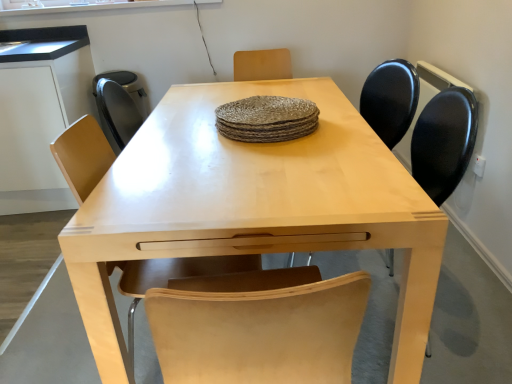
You are a GUI agent. You are given a task and a screenshot of the screen. Output one action in this format:
    pyautogui.click(x=<x>, y=<y>)
    Task: Click on the rustic woven placemat at center
    Image resolution: width=512 pixels, height=384 pixels.
    Given the screenshot: What is the action you would take?
    pyautogui.click(x=267, y=119)

Where is `matte black computer desk at left`? matte black computer desk at left is located at coordinates pyautogui.click(x=40, y=112).

Locate an element on the screen. The image size is (512, 384). light wood table at center is located at coordinates (254, 205).

Is the depth of matte black computer desk at left greater than that of light brown wood chair at center, the 2th chair in the right-to-left sequence?

Yes, it is.

From the picture: Who is shorter, matte black computer desk at left or light brown wood chair at center, the 2th chair in the right-to-left sequence?

light brown wood chair at center, the 2th chair in the right-to-left sequence.

Is matte black computer desk at left bigger or smaller than light brown wood chair at center, the 2th chair in the right-to-left sequence?

A: Considering their sizes, matte black computer desk at left takes up more space than light brown wood chair at center, the 2th chair in the right-to-left sequence.

Identify the location of computer desk on the left of light brown wood chair at center, the first chair from the left. click(40, 112).

Would you say light wood table at center is a long distance from matte black computer desk at left?

Yes, light wood table at center and matte black computer desk at left are located far from each other.

From the image's perspective, between light wood table at center and matte black computer desk at left, which one is located above?

matte black computer desk at left.

Between light wood table at center and matte black computer desk at left, which one appears on the right side from the viewer's perspective?

light wood table at center.

Is light brown wood chair at center, the first chair from the left, positioned before rustic woven placemat at center?

Yes, light brown wood chair at center, the first chair from the left, is in front of rustic woven placemat at center.

Is light brown wood chair at center, the 2th chair in the right-to-left sequence, at the right side of rustic woven placemat at center?

No, light brown wood chair at center, the 2th chair in the right-to-left sequence, is not to the right of rustic woven placemat at center.

Can you see light brown wood chair at center, the first chair from the left, touching rustic woven placemat at center?

light brown wood chair at center, the first chair from the left, and rustic woven placemat at center are not in contact.

Is matte black computer desk at left aimed at rustic woven placemat at center?

No, matte black computer desk at left does not turn towards rustic woven placemat at center.

How much distance is there between matte black computer desk at left and rustic woven placemat at center?

matte black computer desk at left and rustic woven placemat at center are 1.35 meters apart from each other.

Based on the photo, is matte black computer desk at left far from rustic woven placemat at center?

Yes.

Considering the positions of objects matte black computer desk at left and rustic woven placemat at center in the image provided, who is more to the right, matte black computer desk at left or rustic woven placemat at center?

rustic woven placemat at center is more to the right.

Consider the image. Which object is more forward, rustic woven placemat at center or light brown wood chair at center, the first chair from the left?

light brown wood chair at center, the first chair from the left, is closer to the camera.

Could light brown wood chair at center, the 2th chair in the right-to-left sequence, be considered to be inside rustic woven placemat at center?

Definitely not — light brown wood chair at center, the 2th chair in the right-to-left sequence, is not inside rustic woven placemat at center.

Considering the sizes of objects rustic woven placemat at center and light brown wood chair at center, the first chair from the left, in the image provided, who is bigger, rustic woven placemat at center or light brown wood chair at center, the first chair from the left,?

With larger size is light brown wood chair at center, the first chair from the left.

Locate an element on the screen. This screenshot has width=512, height=384. chair to the left of rustic woven placemat at center is located at coordinates (170, 277).

Which object is wider, light brown wood chair at center, the first chair from the left, or matte black computer desk at left?

With larger width is matte black computer desk at left.

Between light brown wood chair at center, the first chair from the left, and matte black computer desk at left, which one has less height?

light brown wood chair at center, the first chair from the left.

Measure the distance between light brown wood chair at center, the first chair from the left, and matte black computer desk at left.

A distance of 1.24 meters exists between light brown wood chair at center, the first chair from the left, and matte black computer desk at left.

In the scene shown: Does light brown wood chair at center, the 2th chair in the right-to-left sequence, have a smaller size compared to matte black computer desk at left?

Indeed, light brown wood chair at center, the 2th chair in the right-to-left sequence, has a smaller size compared to matte black computer desk at left.

Can you confirm if light wood table at center is taller than matte black chair at center, the second chair in the left-to-right sequence?

In fact, light wood table at center may be shorter than matte black chair at center, the second chair in the left-to-right sequence.

Considering the relative positions of light wood table at center and matte black chair at center, the second chair in the left-to-right sequence, in the image provided, is light wood table at center to the right of matte black chair at center, the second chair in the left-to-right sequence, from the viewer's perspective?

In fact, light wood table at center is to the left of matte black chair at center, the second chair in the left-to-right sequence.

From the image's perspective, who appears lower, light wood table at center or matte black chair at center, the second chair in the left-to-right sequence?

light wood table at center appears lower in the image.

Find the location of a particular element. The height and width of the screenshot is (384, 512). computer desk above the light brown wood chair at center, the 2th chair in the right-to-left sequence (from a real-world perspective) is located at coordinates (40, 112).

At what (x,y) coordinates should I click in order to perform the action: click on computer desk above the light wood table at center (from the image's perspective). Please return your answer as a coordinate pair (x, y). Image resolution: width=512 pixels, height=384 pixels. Looking at the image, I should click on (40, 112).

Based on the photo, from the image, which object appears to be farther from light wood table at center, matte black chair at center, the first chair viewed from the right, or rustic woven placemat at center?

matte black chair at center, the first chair viewed from the right, lies further to light wood table at center than the other object.

Based on their spatial positions, is matte black computer desk at left or matte black chair at center, the first chair viewed from the right, closer to rustic woven placemat at center?

matte black chair at center, the first chair viewed from the right, is positioned closer to the anchor rustic woven placemat at center.

Estimate the real-world distances between objects in this image. Which object is further from rustic woven placemat at center, matte black chair at center, the second chair in the left-to-right sequence, or matte black computer desk at left?

matte black computer desk at left lies further to rustic woven placemat at center than the other object.

Considering their positions, is matte black computer desk at left positioned further to matte black chair at center, the second chair in the left-to-right sequence, than rustic woven placemat at center?

Based on the image, matte black computer desk at left appears to be further to matte black chair at center, the second chair in the left-to-right sequence.

From the image, which object appears to be nearer to matte black chair at center, the second chair in the left-to-right sequence, light brown wood chair at center, the first chair from the left, or rustic woven placemat at center?

rustic woven placemat at center lies closer to matte black chair at center, the second chair in the left-to-right sequence, than the other object.

Based on their spatial positions, is matte black computer desk at left or light brown wood chair at center, the first chair from the left, further from rustic woven placemat at center?

matte black computer desk at left is positioned further to the anchor rustic woven placemat at center.

Looking at the image, which one is located further to matte black computer desk at left, rustic woven placemat at center or light brown wood chair at center, the first chair from the left?

rustic woven placemat at center is further to matte black computer desk at left.

Estimate the real-world distances between objects in this image. Which object is closer to matte black chair at center, the second chair in the left-to-right sequence, light wood table at center or rustic woven placemat at center?

Based on the image, rustic woven placemat at center appears to be nearer to matte black chair at center, the second chair in the left-to-right sequence.

Image resolution: width=512 pixels, height=384 pixels. I want to click on table between matte black computer desk at left and matte black chair at center, the second chair in the left-to-right sequence, from left to right, so click(x=254, y=205).

In order to click on food between light wood table at center and matte black chair at center, the second chair in the left-to-right sequence, in the front-back direction in this screenshot , I will do `click(267, 119)`.

At what (x,y) coordinates should I click in order to perform the action: click on food between matte black computer desk at left and matte black chair at center, the second chair in the left-to-right sequence. Please return your answer as a coordinate pair (x, y). The image size is (512, 384). Looking at the image, I should click on (267, 119).

The height and width of the screenshot is (384, 512). I want to click on table between rustic woven placemat at center and light brown wood chair at center, the 2th chair in the right-to-left sequence, vertically, so click(x=254, y=205).